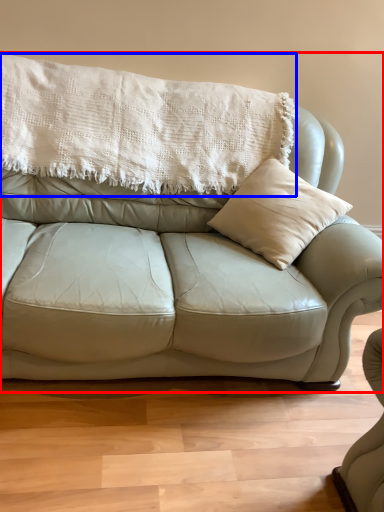
Question: Which object is further to the camera taking this photo, studio couch (highlighted by a red box) or blanket (highlighted by a blue box)?

Choices:
 (A) studio couch
 (B) blanket

Answer: (B)